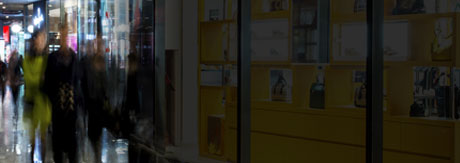
This screenshot has height=163, width=460. Identify the location of floor. (8, 124), (124, 156), (12, 156).